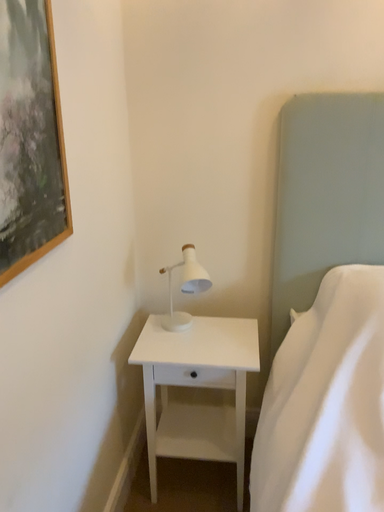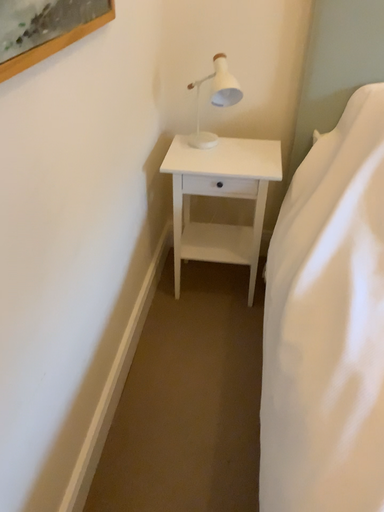
Question: Which way did the camera rotate in the video?

Choices:
 (A) rotated downward
 (B) rotated upward

Answer: (A)